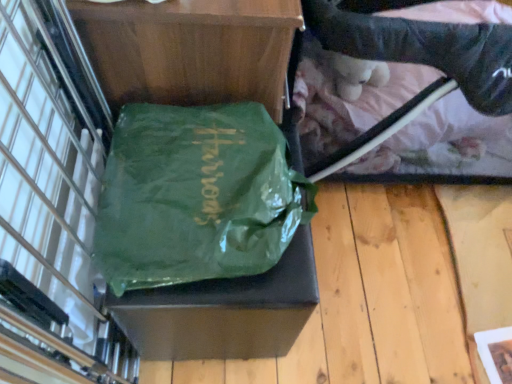
Question: Is green shiny tote bag at center not within black plastic baby carriage at upper right?

Choices:
 (A) yes
 (B) no

Answer: (A)

Question: Can you confirm if green shiny tote bag at center is positioned to the right of black plastic baby carriage at upper right?

Choices:
 (A) yes
 (B) no

Answer: (B)

Question: Considering the relative sizes of green shiny tote bag at center and black plastic baby carriage at upper right in the image provided, is green shiny tote bag at center thinner than black plastic baby carriage at upper right?

Choices:
 (A) yes
 (B) no

Answer: (A)

Question: From a real-world perspective, is green shiny tote bag at center below black plastic baby carriage at upper right?

Choices:
 (A) no
 (B) yes

Answer: (A)

Question: Can you confirm if green shiny tote bag at center is wider than black plastic baby carriage at upper right?

Choices:
 (A) yes
 (B) no

Answer: (B)

Question: Does green shiny tote bag at center have a smaller size compared to black plastic baby carriage at upper right?

Choices:
 (A) yes
 (B) no

Answer: (A)

Question: Is the depth of black plastic baby carriage at upper right greater than that of green shiny tote bag at center?

Choices:
 (A) yes
 (B) no

Answer: (A)

Question: From the image's perspective, is black plastic baby carriage at upper right beneath green shiny tote bag at center?

Choices:
 (A) yes
 (B) no

Answer: (B)

Question: Would you say black plastic baby carriage at upper right is a long distance from green shiny tote bag at center?

Choices:
 (A) yes
 (B) no

Answer: (B)

Question: Considering the relative sizes of black plastic baby carriage at upper right and green shiny tote bag at center in the image provided, is black plastic baby carriage at upper right thinner than green shiny tote bag at center?

Choices:
 (A) no
 (B) yes

Answer: (A)

Question: Is black plastic baby carriage at upper right to the right of green shiny tote bag at center from the viewer's perspective?

Choices:
 (A) yes
 (B) no

Answer: (A)

Question: Is black plastic baby carriage at upper right positioned beyond the bounds of green shiny tote bag at center?

Choices:
 (A) yes
 (B) no

Answer: (A)

Question: From the image's perspective, is black plastic baby carriage at upper right located above or below green shiny tote bag at center?

Choices:
 (A) below
 (B) above

Answer: (B)